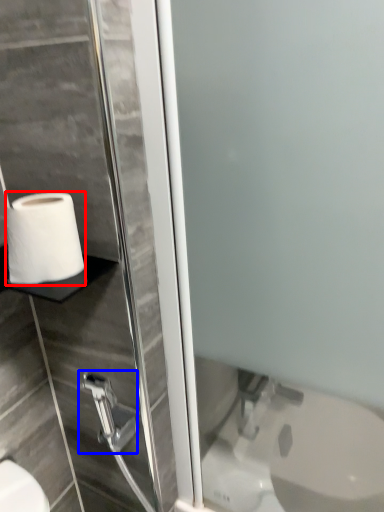
Question: Which object is closer to the camera taking this photo, toilet paper (highlighted by a red box) or shower (highlighted by a blue box)?

Choices:
 (A) toilet paper
 (B) shower

Answer: (A)